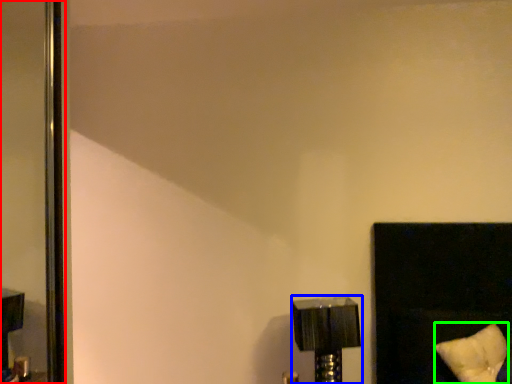
Question: Estimate the real-world distances between objects in this image. Which object is farther from screen door (highlighted by a red box), lamp (highlighted by a blue box) or pillow (highlighted by a green box)?

Choices:
 (A) lamp
 (B) pillow

Answer: (B)